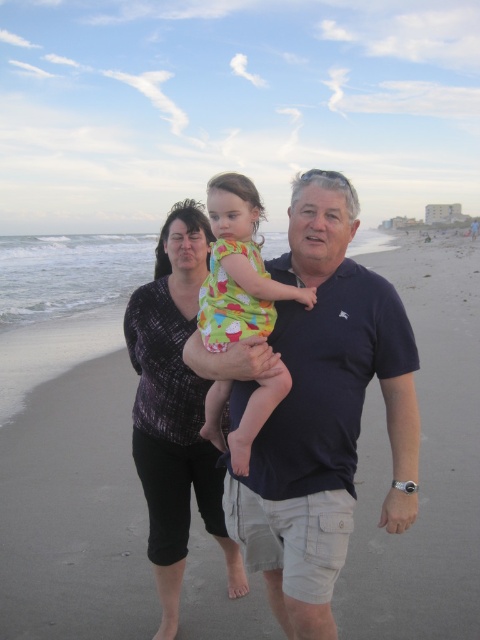
Does beige sand at center have a greater width compared to dark blue cotton polo shirt at center?

Indeed, beige sand at center has a greater width compared to dark blue cotton polo shirt at center.

Where is `beige sand at center`? This screenshot has width=480, height=640. beige sand at center is located at coordinates (423, 461).

Does point (460, 467) come in front of point (394, 296)?

No, it is not.

What are the coordinates of `beige sand at center` in the screenshot? It's located at (423, 461).

Is point (470, 586) positioned before point (265, 305)?

That is False.

In the scene shown: Between beige sand at center and printed cotton dress at center, which one appears on the left side from the viewer's perspective?

printed cotton dress at center

Who is more forward, (134, 612) or (219, 282)?

Point (219, 282) is more forward.

This screenshot has width=480, height=640. I want to click on beige sand at center, so click(x=423, y=461).

Who is taller, printed fabric dress at center or printed cotton dress at center?

printed fabric dress at center is taller.

Does printed fabric dress at center lie in front of printed cotton dress at center?

No.

What are the coordinates of `printed fabric dress at center` in the screenshot? It's located at (175, 410).